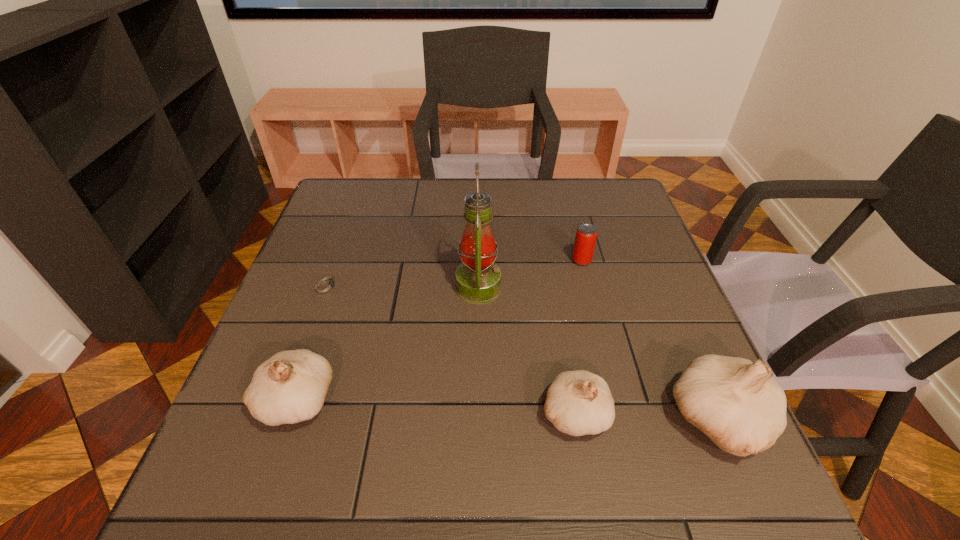
Identify the location of vacant space at the near edge. (418, 413).

In the image, there is a desktop. Where is `vacant space at the left edge`? This screenshot has width=960, height=540. vacant space at the left edge is located at coordinates (304, 302).

Find the location of a particular element. free space at the right edge is located at coordinates (661, 383).

The height and width of the screenshot is (540, 960). Find the location of `blank area at the far left corner`. blank area at the far left corner is located at coordinates (351, 218).

This screenshot has width=960, height=540. What are the coordinates of `free space between the shortest object and the shortest garlic` in the screenshot? It's located at (450, 349).

You are a GUI agent. You are given a task and a screenshot of the screen. Output one action in this format:
    pyautogui.click(x=<x>, y=<y>)
    Task: Click on the empty space between the rightmost object and the fourth shortest object
    This screenshot has height=540, width=960.
    Given the screenshot: What is the action you would take?
    pyautogui.click(x=508, y=410)

Find the location of a particular element. This screenshot has height=540, width=960. unoccupied position between the second shortest object and the oil lamp is located at coordinates (530, 274).

The height and width of the screenshot is (540, 960). I want to click on empty location between the second shortest object and the watch, so click(454, 273).

Identify the location of free point between the rightmost garlic and the shortest garlic. (646, 417).

The height and width of the screenshot is (540, 960). I want to click on free area in between the rightmost object and the leftmost garlic, so tap(508, 410).